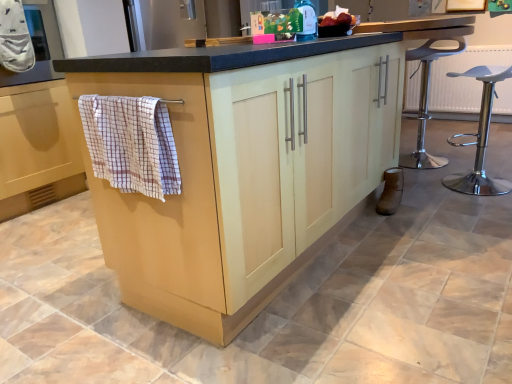
Question: Is matte gray oven at upper left positioned with its back to brown suede boot at lower right?

Choices:
 (A) yes
 (B) no

Answer: (B)

Question: Is matte gray oven at upper left facing towards brown suede boot at lower right?

Choices:
 (A) yes
 (B) no

Answer: (A)

Question: Is matte gray oven at upper left wider than brown suede boot at lower right?

Choices:
 (A) no
 (B) yes

Answer: (B)

Question: Is brown suede boot at lower right inside matte gray oven at upper left?

Choices:
 (A) no
 (B) yes

Answer: (A)

Question: Does matte gray oven at upper left have a lesser width compared to brown suede boot at lower right?

Choices:
 (A) yes
 (B) no

Answer: (B)

Question: From the image's perspective, relative to white plastic stool at right, is white cotton oven mitt at upper left, positioned as the 2th bath towel in bottom-to-top order, above or below?

Choices:
 (A) above
 (B) below

Answer: (A)

Question: Considering the relative positions of white cotton oven mitt at upper left, the second bath towel viewed from the front, and white plastic stool at right in the image provided, is white cotton oven mitt at upper left, the second bath towel viewed from the front, to the left or to the right of white plastic stool at right?

Choices:
 (A) left
 (B) right

Answer: (A)

Question: Is white cotton oven mitt at upper left, the first bath towel in the back-to-front sequence, wider or thinner than white plastic stool at right?

Choices:
 (A) wide
 (B) thin

Answer: (B)

Question: Is point (5, 13) positioned closer to the camera than point (502, 76)?

Choices:
 (A) farther
 (B) closer

Answer: (B)

Question: Based on their positions, is brown suede boot at lower right located to the left or right of green matte bottle at upper center?

Choices:
 (A) right
 (B) left

Answer: (A)

Question: From a real-world perspective, is brown suede boot at lower right above or below green matte bottle at upper center?

Choices:
 (A) above
 (B) below

Answer: (B)

Question: From the image's perspective, is brown suede boot at lower right located above or below green matte bottle at upper center?

Choices:
 (A) above
 (B) below

Answer: (B)

Question: Considering the positions of brown suede boot at lower right and green matte bottle at upper center in the image, is brown suede boot at lower right wider or thinner than green matte bottle at upper center?

Choices:
 (A) wide
 (B) thin

Answer: (B)

Question: From the image's perspective, relative to brown suede boot at lower right, is white plastic stool at right above or below?

Choices:
 (A) below
 (B) above

Answer: (B)

Question: Considering the positions of white plastic stool at right and brown suede boot at lower right in the image, is white plastic stool at right bigger or smaller than brown suede boot at lower right?

Choices:
 (A) small
 (B) big

Answer: (B)